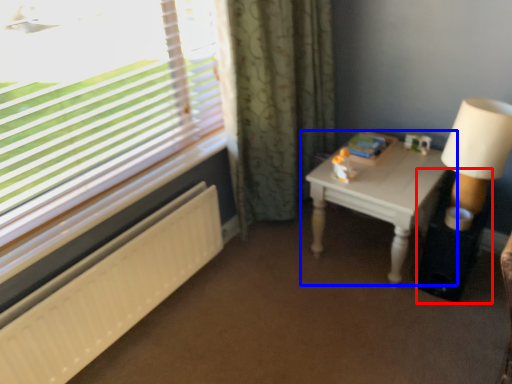
Question: Among these objects, which one is farthest to the camera, side table (highlighted by a red box) or table (highlighted by a blue box)?

Choices:
 (A) side table
 (B) table

Answer: (A)